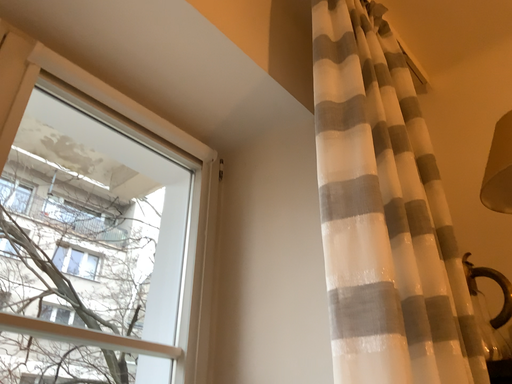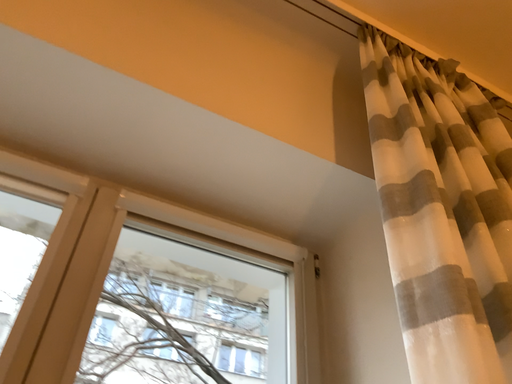
Question: Which way did the camera rotate in the video?

Choices:
 (A) rotated right
 (B) rotated left

Answer: (B)